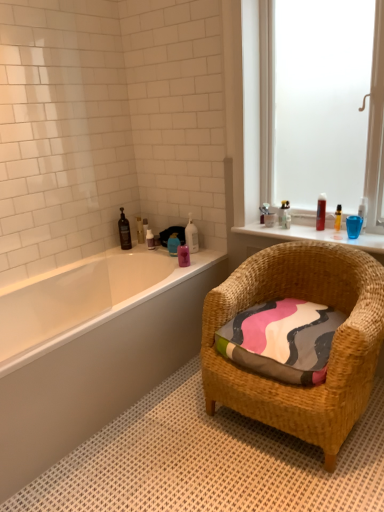
Question: Which direction should I rotate to face translucent plastic bottle at upper center, acting as the 5th toiletry starting from the left, — up or down?

Choices:
 (A) up
 (B) down

Answer: (A)

Question: Can you confirm if translucent glass bottles at upper right is smaller than pink glossy bottle at upper center, which is the fifth toiletry in right-to-left order?

Choices:
 (A) no
 (B) yes

Answer: (A)

Question: Considering the relative positions of translucent glass bottles at upper right and pink glossy bottle at upper center, positioned as the sixth toiletry in left-to-right order, in the image provided, is translucent glass bottles at upper right to the left of pink glossy bottle at upper center, positioned as the sixth toiletry in left-to-right order, from the viewer's perspective?

Choices:
 (A) yes
 (B) no

Answer: (B)

Question: Does translucent glass bottles at upper right come behind pink glossy bottle at upper center, which is the fifth toiletry in right-to-left order?

Choices:
 (A) no
 (B) yes

Answer: (A)

Question: Is the position of translucent glass bottles at upper right less distant than that of pink glossy bottle at upper center, which is the fifth toiletry in right-to-left order?

Choices:
 (A) no
 (B) yes

Answer: (B)

Question: Would you consider translucent glass bottles at upper right to be distant from pink glossy bottle at upper center, which is the fifth toiletry in right-to-left order?

Choices:
 (A) no
 (B) yes

Answer: (A)

Question: Can you confirm if translucent glass bottles at upper right is wider than pink glossy bottle at upper center, positioned as the sixth toiletry in left-to-right order?

Choices:
 (A) no
 (B) yes

Answer: (B)

Question: Is shiny brown bottle at left, which ranks as the first toiletry in left-to-right order, next to pink glossy bottle at upper center, positioned as the sixth toiletry in left-to-right order?

Choices:
 (A) yes
 (B) no

Answer: (B)

Question: From a real-world perspective, is shiny brown bottle at left, marked as the tenth toiletry in a right-to-left arrangement, located higher than pink glossy bottle at upper center, positioned as the sixth toiletry in left-to-right order?

Choices:
 (A) yes
 (B) no

Answer: (A)

Question: Is the position of shiny brown bottle at left, which ranks as the first toiletry in left-to-right order, more distant than that of pink glossy bottle at upper center, positioned as the sixth toiletry in left-to-right order?

Choices:
 (A) yes
 (B) no

Answer: (A)

Question: Is shiny brown bottle at left, which ranks as the first toiletry in left-to-right order, at the right side of pink glossy bottle at upper center, positioned as the sixth toiletry in left-to-right order?

Choices:
 (A) no
 (B) yes

Answer: (A)

Question: Is shiny brown bottle at left, marked as the tenth toiletry in a right-to-left arrangement, not within pink glossy bottle at upper center, positioned as the sixth toiletry in left-to-right order?

Choices:
 (A) no
 (B) yes

Answer: (B)

Question: Is pink glossy bottle at upper center, which is the fifth toiletry in right-to-left order, at the back of shiny brown bottle at left, marked as the tenth toiletry in a right-to-left arrangement?

Choices:
 (A) no
 (B) yes

Answer: (A)

Question: Does shiny brown bottle at left, marked as the tenth toiletry in a right-to-left arrangement, have a greater width compared to clear plastic bottle at upper right, which is the eighth toiletry in left-to-right order?

Choices:
 (A) no
 (B) yes

Answer: (A)